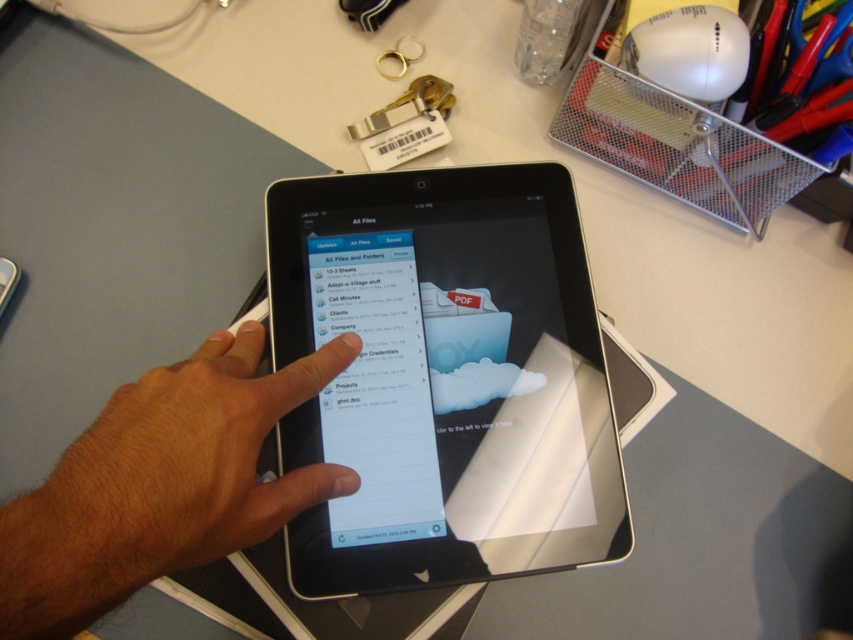
You are a virtual assistant trying to locate the tablet on the desk. According to the image, where is the black glossy tablet at center located in terms of its 2D coordinates?

The black glossy tablet at center is located at the 2D coordinates point [444,378].